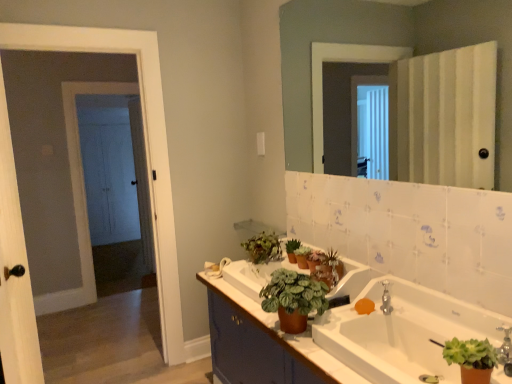
Question: In terms of width, does brown matte cabinet at lower center look wider or thinner when compared to green matte plant at center?

Choices:
 (A) wide
 (B) thin

Answer: (A)

Question: Is brown matte cabinet at lower center inside or outside of green matte plant at center?

Choices:
 (A) inside
 (B) outside

Answer: (B)

Question: Based on their relative distances, which object is farther from the green matte plant at center?

Choices:
 (A) green matte plant at lower right, which ranks as the first houseplant in right-to-left order
 (B) white glossy mirror at upper center
 (C) green matte plant at upper center, the third houseplant from the left
 (D) white wood screen door at left
 (E) green matte plant at center, which appears as the first houseplant when viewed from the left

Answer: (D)

Question: Which object is the closest to the green matte houseplant at center, the second houseplant viewed from the left?

Choices:
 (A) orange matte soap at sink
 (B) green matte plant at center
 (C) green matte plant at upper center, the 2th houseplant when ordered from right to left
 (D) white wood screen door at left
 (E) white wooden door at left

Answer: (B)